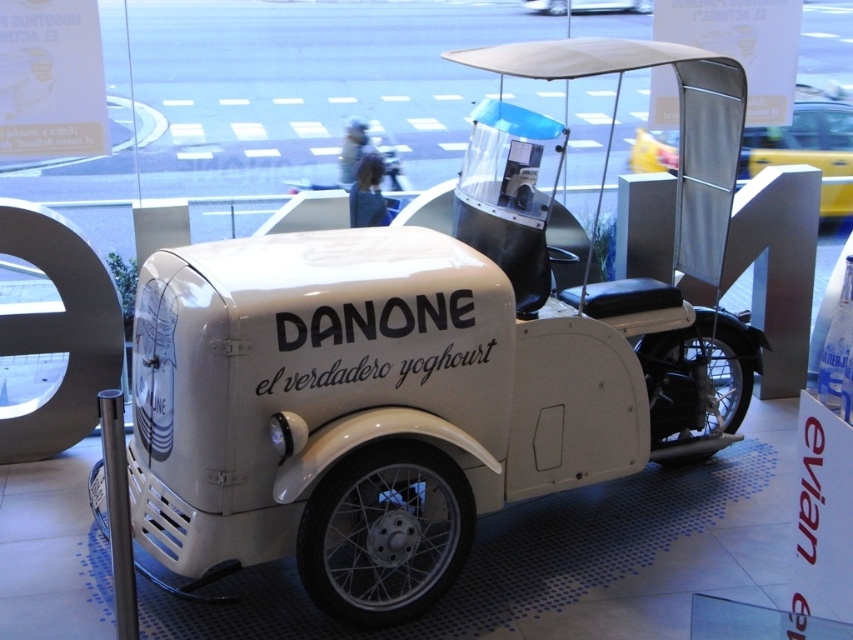
Question: In this image, where is white matte cart at center located relative to white matte motorcycle at center?

Choices:
 (A) above
 (B) below

Answer: (B)

Question: Which point is closer to the camera?

Choices:
 (A) (685, 435)
 (B) (831, 188)

Answer: (A)

Question: Is white matte cart at center positioned behind white matte motorcycle at upper center?

Choices:
 (A) yes
 (B) no

Answer: (B)

Question: Which point is farther from the camera taking this photo?

Choices:
 (A) (844, 131)
 (B) (154, 397)
 (C) (560, 1)

Answer: (C)

Question: Among these points, which one is farthest from the camera?

Choices:
 (A) 535,3
 (B) 299,326

Answer: (A)

Question: Does white matte cart at center have a lesser width compared to white matte motorcycle at center?

Choices:
 (A) yes
 (B) no

Answer: (B)